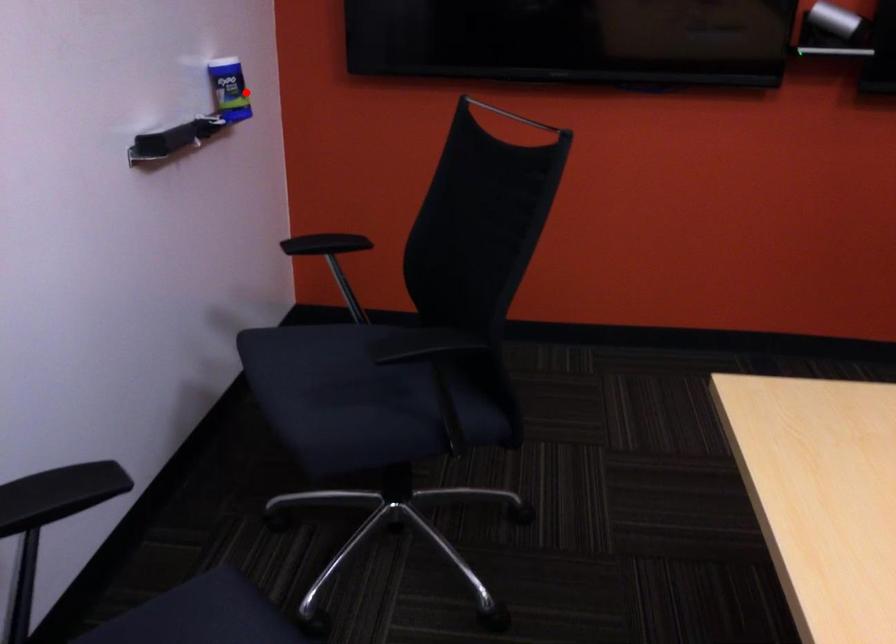
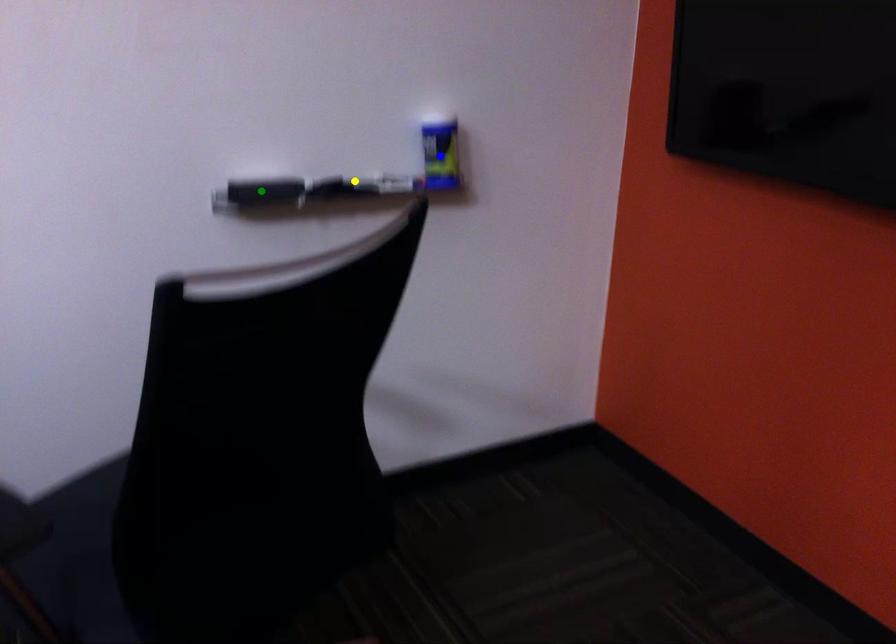
Question: I am providing you with two images of the same scene from different viewpoints. A red point is marked on the first image. You are given multiple points on the second image. Which mark in image 2 goes with the point in image 1?

Choices:
 (A) yellow point
 (B) green point
 (C) blue point

Answer: (C)